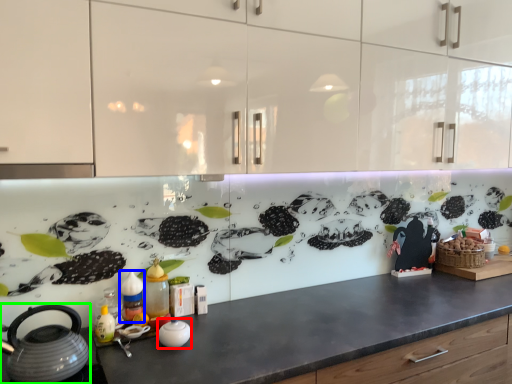
Question: Which is farther away from appliance (highlighted by a red box)? bottle (highlighted by a blue box) or kettle (highlighted by a green box)?

Choices:
 (A) bottle
 (B) kettle

Answer: (B)